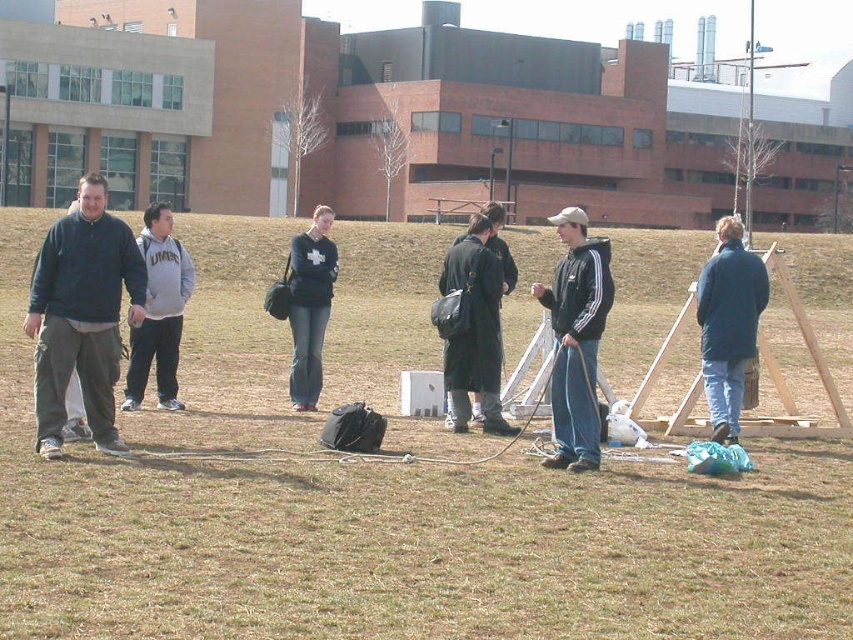
You are a photographer positioned at the edge of the grassy area. You want to take a photo that includes both the brown dry grass at center and the blue matte jacket at right. Which object will appear larger in the photo?

The brown dry grass at center will appear larger in the photo because it is closer to the viewer than the blue matte jacket at right.

You are a photographer trying to capture a group photo of the dark gray coat at center and the matte black jacket at center. The camera you are using has a minimum focus distance of 2 meters. Will you be able to focus on both subjects clearly without moving closer?

The dark gray coat at center and matte black jacket at center are 2.28 meters apart. Since the minimum focus distance is 2 meters, the photographer can focus on both subjects clearly as the distance between them is within the camera range.